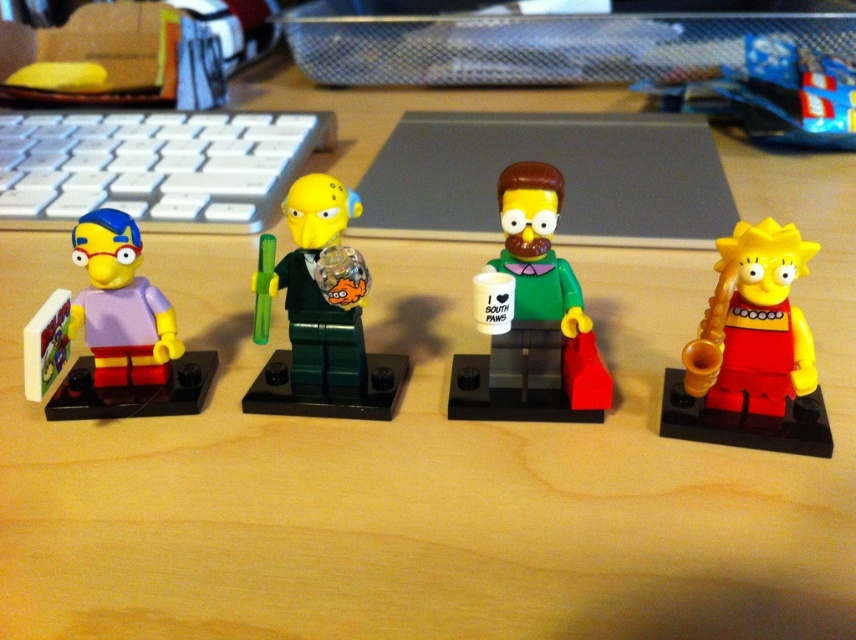
Does green matte figure at center appear on the left side of matte purple plastic toy at left?

Incorrect, green matte figure at center is not on the left side of matte purple plastic toy at left.

Measure the distance from green matte figure at center to matte purple plastic toy at left.

green matte figure at center and matte purple plastic toy at left are 19.53 inches apart.

The height and width of the screenshot is (640, 856). Describe the element at coordinates (533, 320) in the screenshot. I see `green matte figure at center` at that location.

You are a GUI agent. You are given a task and a screenshot of the screen. Output one action in this format:
    pyautogui.click(x=<x>, y=<y>)
    Task: Click on the green matte figure at center
    The height and width of the screenshot is (640, 856).
    Given the screenshot: What is the action you would take?
    pyautogui.click(x=533, y=320)

Which is more to the left, white plastic keyboard at upper left or green matte figure at center?

white plastic keyboard at upper left is more to the left.

Is white plastic keyboard at upper left taller than green matte figure at center?

In fact, white plastic keyboard at upper left may be shorter than green matte figure at center.

Who is more distant from viewer, (193,220) or (559,307)?

Positioned behind is point (193,220).

Image resolution: width=856 pixels, height=640 pixels. In order to click on white plastic keyboard at upper left in this screenshot , I will do pos(153,166).

This screenshot has height=640, width=856. What do you see at coordinates (752, 353) in the screenshot?
I see `matte yellow saxophone at right` at bounding box center [752, 353].

Is point (685, 429) in front of point (782, 44)?

Yes.

Where is `matte yellow saxophone at right`? The height and width of the screenshot is (640, 856). matte yellow saxophone at right is located at coordinates (752, 353).